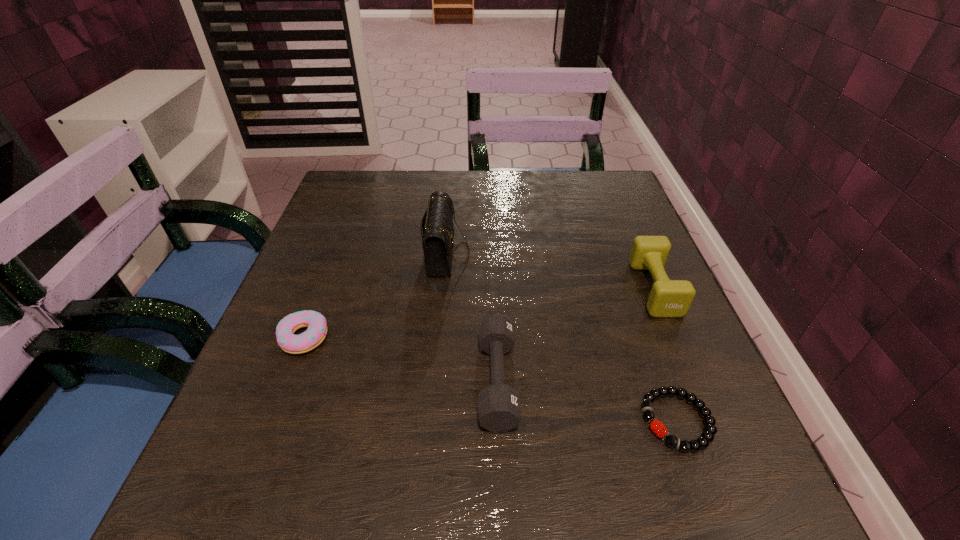
At what (x,y) coordinates should I click in order to perform the action: click on the fourth object from right to left. Please return your answer as a coordinate pair (x, y). Looking at the image, I should click on click(437, 230).

Where is `the tallest object`? The image size is (960, 540). the tallest object is located at coordinates (437, 230).

This screenshot has width=960, height=540. I want to click on the right dumbbell, so click(x=668, y=298).

The height and width of the screenshot is (540, 960). What are the coordinates of `the nearer dumbbell` in the screenshot? It's located at (499, 410).

This screenshot has height=540, width=960. I want to click on the third shortest object, so click(499, 410).

Where is `the leftmost object`? The image size is (960, 540). the leftmost object is located at coordinates (316, 332).

You are a GUI agent. You are given a task and a screenshot of the screen. Output one action in this format:
    pyautogui.click(x=<x>, y=<y>)
    Task: Click on the fourth tallest object
    This screenshot has height=540, width=960.
    Given the screenshot: What is the action you would take?
    pyautogui.click(x=316, y=332)

Image resolution: width=960 pixels, height=540 pixels. In order to click on bracelet in this screenshot , I will do `click(707, 436)`.

I want to click on free region located 0.150m on the front flap of the tallest object, so [536, 253].

This screenshot has height=540, width=960. In order to click on vacant region located 0.330m on the front of the right dumbbell in this screenshot , I will do `click(744, 497)`.